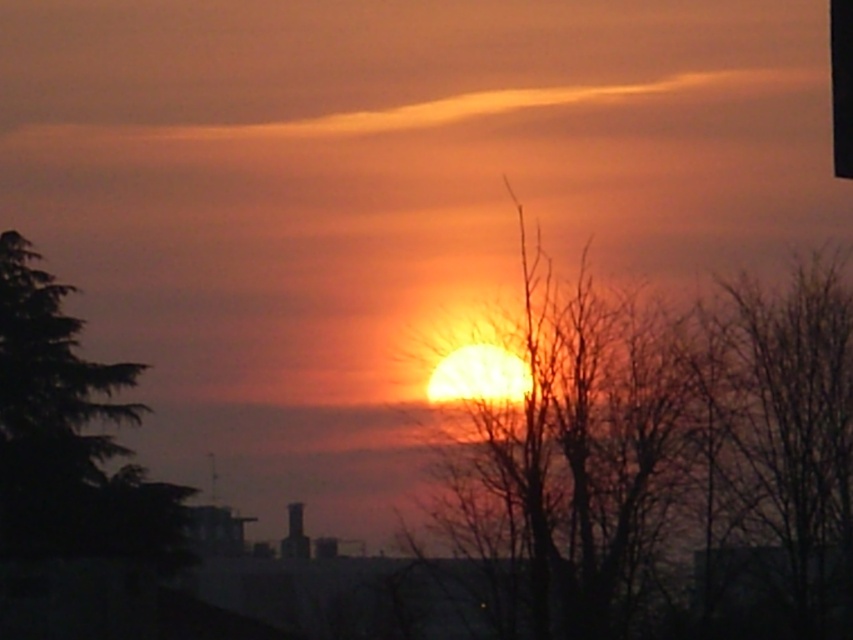
Question: Which point appears farthest from the camera in this image?

Choices:
 (A) (850, 88)
 (B) (65, 410)

Answer: (B)

Question: Is green leafy tree at left above black plastic traffic light at upper right?

Choices:
 (A) no
 (B) yes

Answer: (A)

Question: Which of the following is the closest to the observer?

Choices:
 (A) green leafy tree at left
 (B) bare branches at right

Answer: (B)

Question: From the image, what is the correct spatial relationship of silhouette bare tree at center in relation to black plastic traffic light at upper right?

Choices:
 (A) right
 (B) left

Answer: (B)

Question: Can you confirm if bare branches at right is positioned to the left of green leafy tree at left?

Choices:
 (A) no
 (B) yes

Answer: (A)

Question: Considering the real-world distances, which object is closest to the green leafy tree at left?

Choices:
 (A) silhouette bare tree at center
 (B) black plastic traffic light at upper right
 (C) bare branches at right

Answer: (A)